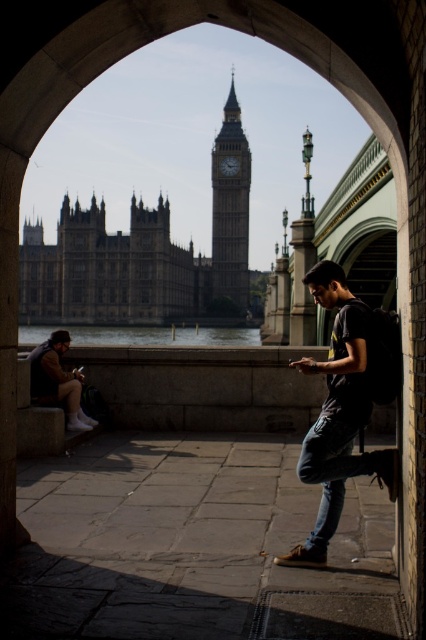
You are a photographer standing near the dark blue jeans at center. You want to take a photo of the camera that is 80.15 meters away. Is the camera visible in the background of your photo?

The camera is 80.15 meters away from the dark blue jeans at center. Since the background includes the Houses of Parliament and Big Ben across the River Thames, the camera might be visible if it is positioned within that area. However, without knowing the camera exact location relative to the landmarks, it is uncertain if it will be in the frame.

You are standing at the point with coordinates point (55, 355) and want to walk to the point with coordinates point (63, 227). Is the destination point behind you or in front of you?

The point (63, 227) is behind point (55, 355), so the destination point is behind you.